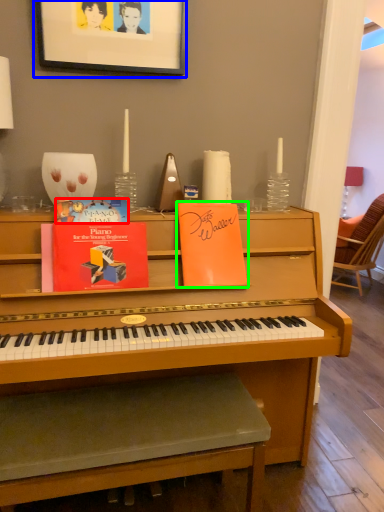
Question: Which object is positioned farthest from paperback book (highlighted by a red box)? Select from picture frame (highlighted by a blue box) and paperback book (highlighted by a green box).

Choices:
 (A) picture frame
 (B) paperback book

Answer: (A)